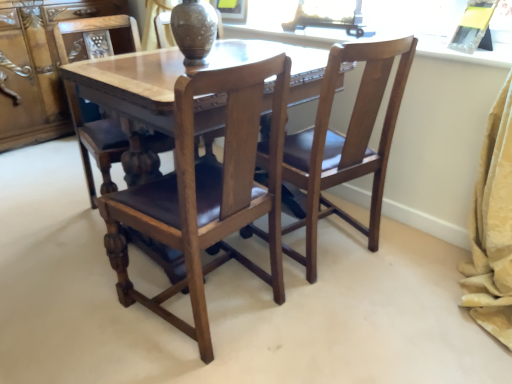
Image resolution: width=512 pixels, height=384 pixels. I want to click on vacant area in front of brown leather chair at center, positioned as the 3th chair in right-to-left order, so click(70, 263).